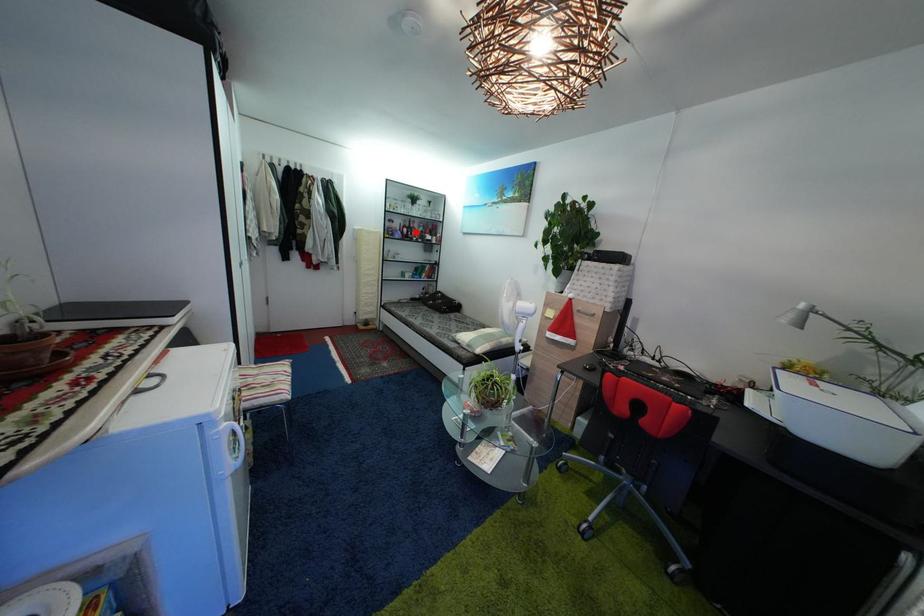
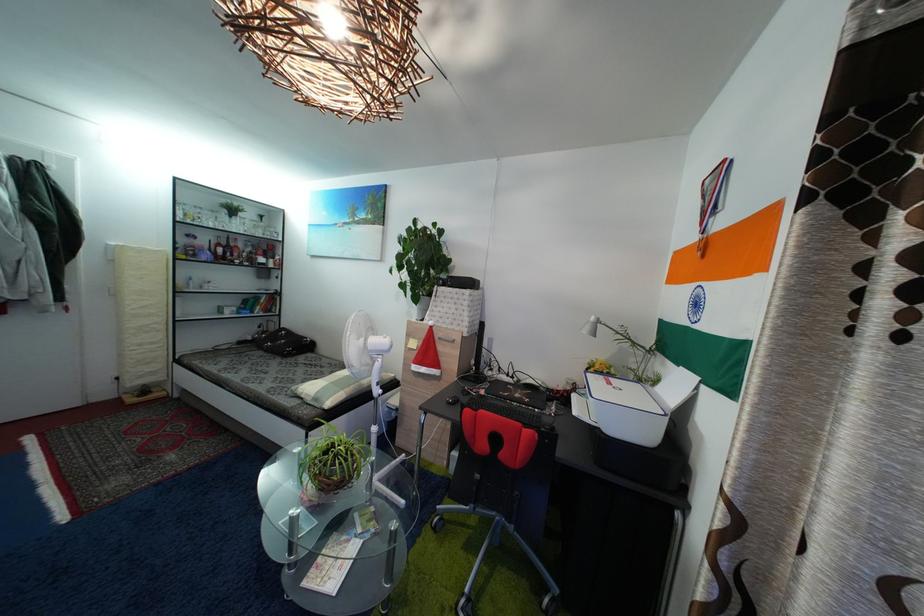
Question: I am providing you with two images of the same scene from different viewpoints. Given a red point in image1, look at the same physical point in image2. Is it:

Choices:
 (A) Closer to the viewpoint
 (B) Farther from the viewpoint

Answer: (B)